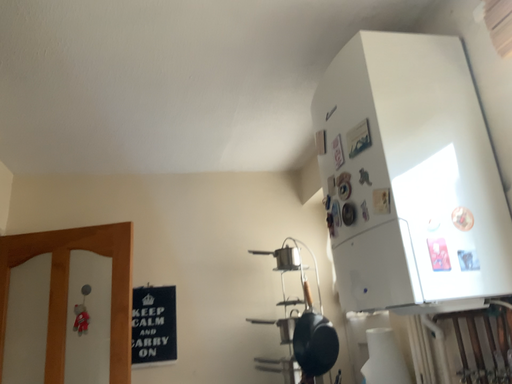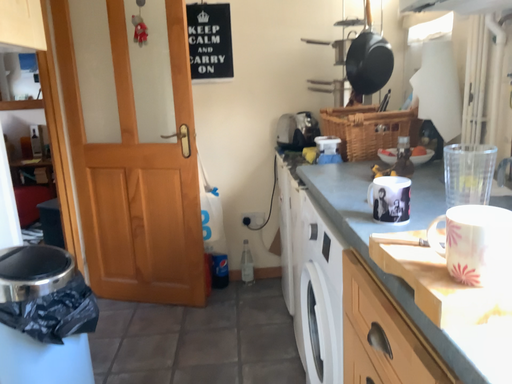
Question: Which way did the camera rotate in the video?

Choices:
 (A) rotated left
 (B) rotated right

Answer: (A)